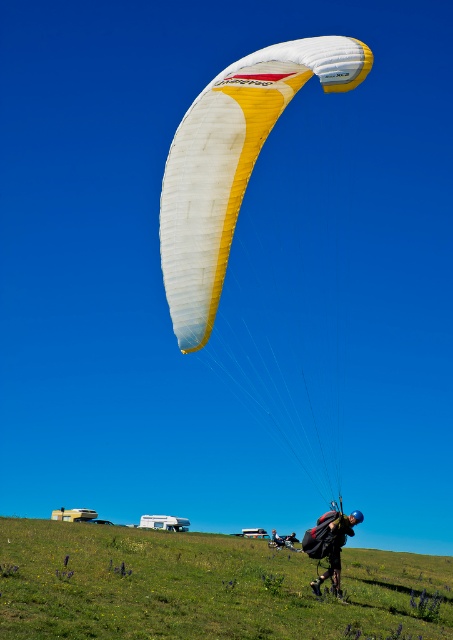
Measure the distance from green grassy field at lower center to white/yellow fabric parachute at upper center.

green grassy field at lower center is 11.56 meters from white/yellow fabric parachute at upper center.

Is green grassy field at lower center shorter than white/yellow fabric parachute at upper center?

No, green grassy field at lower center is not shorter than white/yellow fabric parachute at upper center.

Which is in front, point (362, 611) or point (314, 52)?

Point (314, 52)

Find the location of a particular element. This screenshot has height=640, width=453. green grassy field at lower center is located at coordinates (202, 588).

Is white/yellow fabric parachute at upper center to the left of dark blue fabric parachute at upper center from the viewer's perspective?

Correct, you'll find white/yellow fabric parachute at upper center to the left of dark blue fabric parachute at upper center.

Between white/yellow fabric parachute at upper center and dark blue fabric parachute at upper center, which one appears on the right side from the viewer's perspective?

From the viewer's perspective, dark blue fabric parachute at upper center appears more on the right side.

This screenshot has width=453, height=640. Find the location of `white/yellow fabric parachute at upper center`. white/yellow fabric parachute at upper center is located at coordinates (231, 164).

From the picture: Is green grassy field at lower center to the right of dark blue fabric parachute at upper center from the viewer's perspective?

Incorrect, green grassy field at lower center is not on the right side of dark blue fabric parachute at upper center.

Is green grassy field at lower center thinner than dark blue fabric parachute at upper center?

Incorrect, green grassy field at lower center's width is not less than dark blue fabric parachute at upper center's.

Where is `green grassy field at lower center`? green grassy field at lower center is located at coordinates [202, 588].